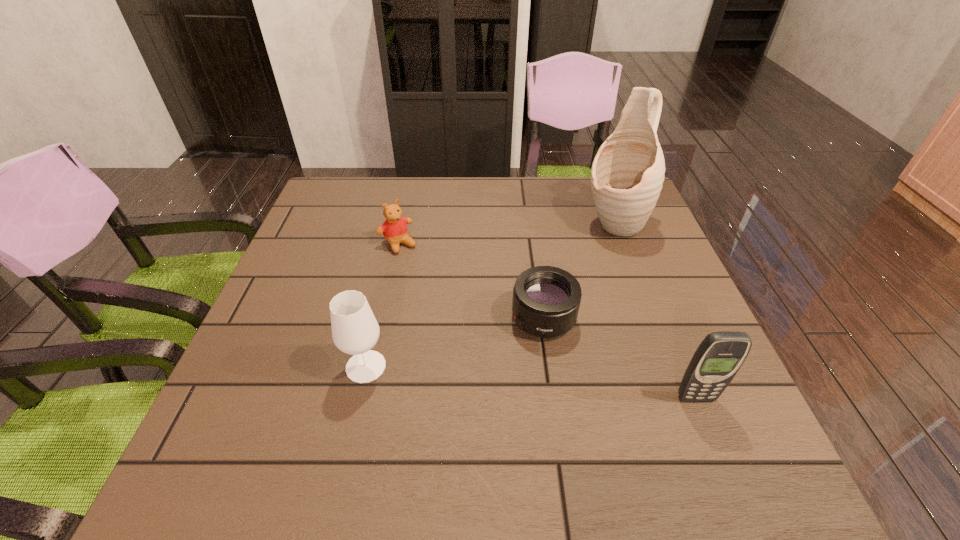
Image resolution: width=960 pixels, height=540 pixels. In order to click on vacant area situated at the spout of the pitcher in this screenshot , I will do `click(561, 296)`.

You are a GUI agent. You are given a task and a screenshot of the screen. Output one action in this format:
    pyautogui.click(x=<x>, y=<y>)
    Task: Click on the free point located on the side of the third farthest object with brand markings and control switches
    The height and width of the screenshot is (540, 960).
    Given the screenshot: What is the action you would take?
    pyautogui.click(x=484, y=370)

Locate an element on the screen. Image resolution: width=960 pixels, height=540 pixels. vacant space located on the side of the third farthest object with brand markings and control switches is located at coordinates (439, 411).

You are a GUI agent. You are given a task and a screenshot of the screen. Output one action in this format:
    pyautogui.click(x=<x>, y=<y>)
    Task: Click on the vacant position located on the side of the third farthest object with brand markings and control switches
    This screenshot has width=960, height=540.
    Given the screenshot: What is the action you would take?
    pyautogui.click(x=494, y=362)

You are a GUI agent. You are given a task and a screenshot of the screen. Output one action in this format:
    pyautogui.click(x=<x>, y=<y>)
    Task: Click on the free space located 0.270m on the front-facing side of the second shortest object
    The image size is (960, 540).
    Given the screenshot: What is the action you would take?
    pyautogui.click(x=461, y=321)

You are a GUI agent. You are given a task and a screenshot of the screen. Output one action in this format:
    pyautogui.click(x=<x>, y=<y>)
    Task: Click on the free point located 0.360m on the front-facing side of the second shortest object
    The image size is (960, 540).
    Given the screenshot: What is the action you would take?
    pyautogui.click(x=484, y=348)

The image size is (960, 540). In order to click on free space located on the front-facing side of the second shortest object in this screenshot , I will do `click(437, 291)`.

I want to click on object that is at the far edge, so click(x=627, y=174).

Locate an element on the screen. Image resolution: width=960 pixels, height=540 pixels. object that is at the near edge is located at coordinates (720, 355).

Locate an element on the screen. The image size is (960, 540). cellular telephone present at the right edge is located at coordinates (720, 355).